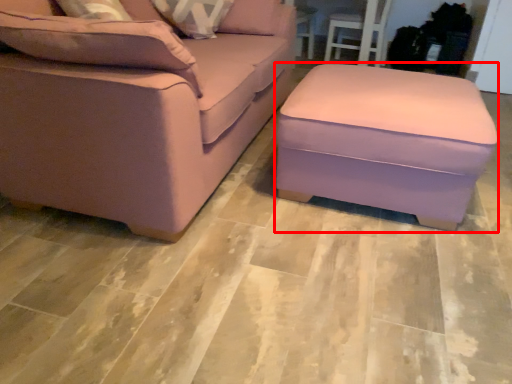
Question: From the image's perspective, considering the relative positions of stool (annotated by the red box) and studio couch in the image provided, where is stool (annotated by the red box) located with respect to the staircase?

Choices:
 (A) below
 (B) above

Answer: (A)